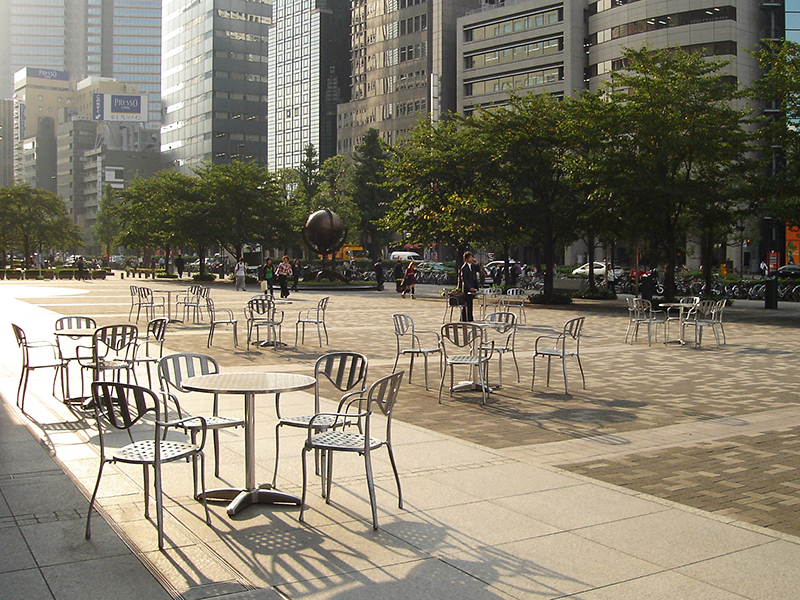
Where is `gray chair`? gray chair is located at coordinates (320, 441).